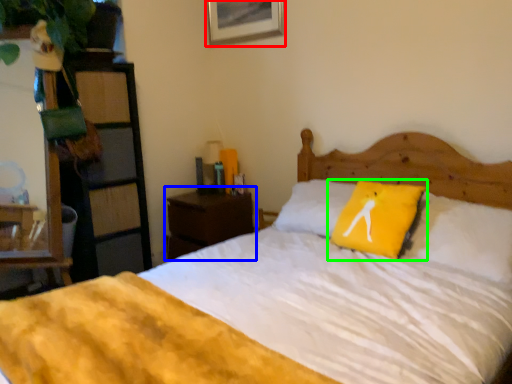
Question: Considering the real-world distances, which object is closest to picture frame (highlighted by a red box)? nightstand (highlighted by a blue box) or pillow (highlighted by a green box).

Choices:
 (A) nightstand
 (B) pillow

Answer: (A)